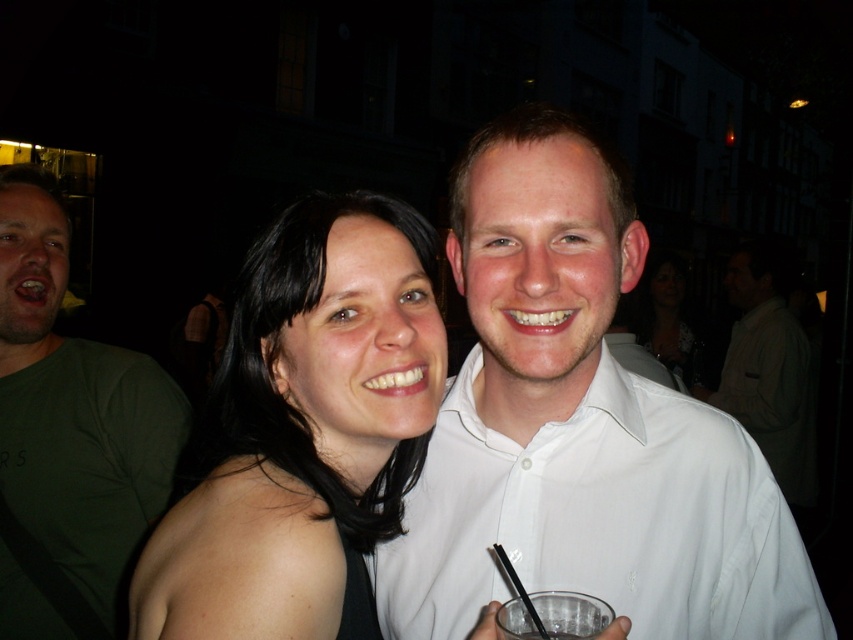
You are a photographer trying to capture a clear shot of the black matte hair at center and the white cotton shirt at upper right. Which object should you focus on first to ensure both are in focus?

You should focus on the black matte hair at center first because it is closer to the camera than the white cotton shirt at upper right. By focusing on the closer object, the farther one will also be in focus due to the depth of field.